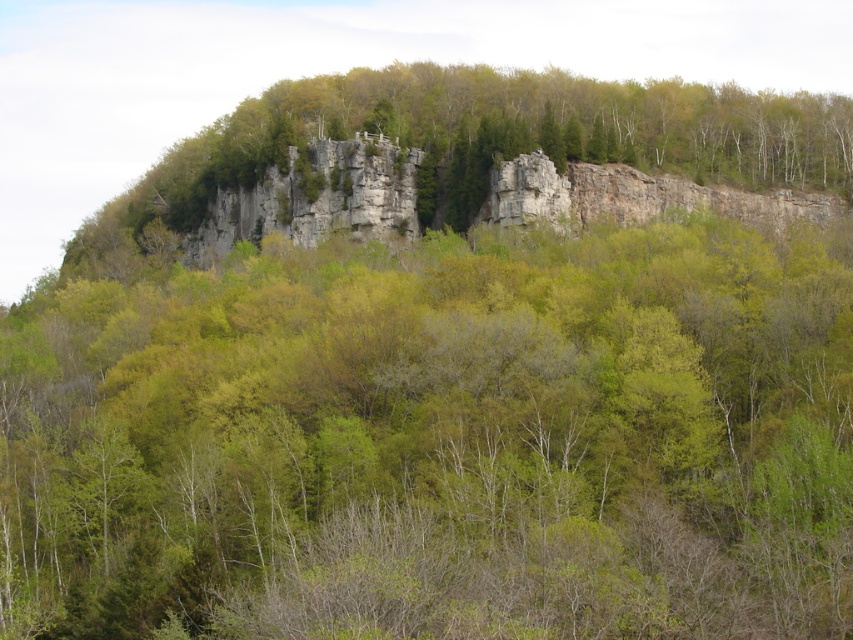
Question: Can you confirm if green leafy tree at upper center is positioned above green leafy tree at center?

Choices:
 (A) yes
 (B) no

Answer: (B)

Question: Is green leafy tree at upper center thinner than green leafy tree at center?

Choices:
 (A) yes
 (B) no

Answer: (A)

Question: Which point is closer to the camera?

Choices:
 (A) green leafy tree at upper center
 (B) green leafy tree at center

Answer: (A)

Question: Which object is farther from the camera taking this photo?

Choices:
 (A) green leafy tree at upper center
 (B) green leafy tree at center

Answer: (B)

Question: From the image, what is the correct spatial relationship of green leafy tree at upper center in relation to green leafy tree at center?

Choices:
 (A) left
 (B) right

Answer: (B)